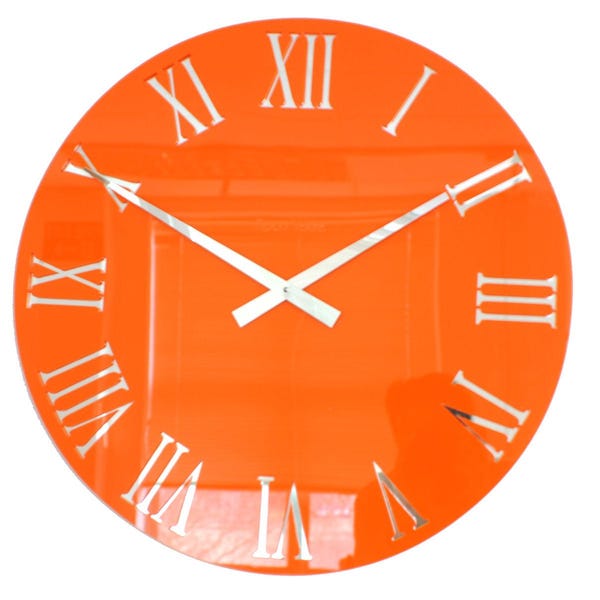
Identify the location of corners. The width and height of the screenshot is (600, 600). (6, 590), (591, 587), (593, 6), (5, 3).